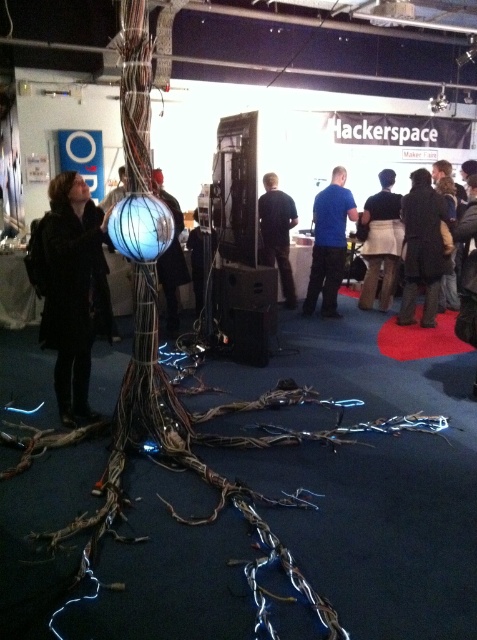
Question: Is dark brown leather jacket at center to the right of dark blue skirt at center from the viewer's perspective?

Choices:
 (A) yes
 (B) no

Answer: (A)

Question: Estimate the real-world distances between objects in this image. Which object is closer to the black matte coat at left?

Choices:
 (A) black fabric at center
 (B) shiny metallic sphere at center

Answer: (B)

Question: Is dark brown leather jacket at center bigger than dark blue fabric jacket at center?

Choices:
 (A) no
 (B) yes

Answer: (B)

Question: Does blue matte shirt at center appear over shiny metallic sphere at center?

Choices:
 (A) no
 (B) yes

Answer: (B)

Question: Estimate the real-world distances between objects in this image. Which object is closer to the black fabric at center?

Choices:
 (A) dark blue skirt at center
 (B) shiny metallic sphere at center

Answer: (A)

Question: Which point appears closest to the camera in this image?

Choices:
 (A) (311, 298)
 (B) (169, 198)

Answer: (B)